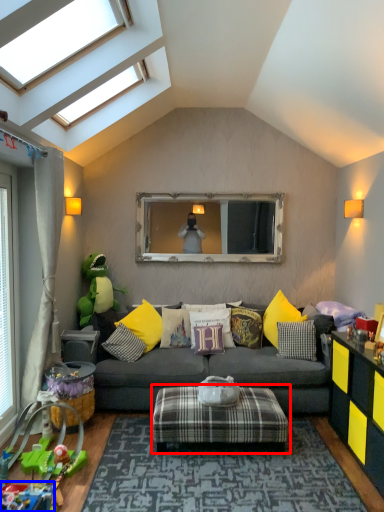
Question: Which object appears closest to the camera in this image, stool (highlighted by a red box) or toy (highlighted by a blue box)?

Choices:
 (A) stool
 (B) toy

Answer: (B)